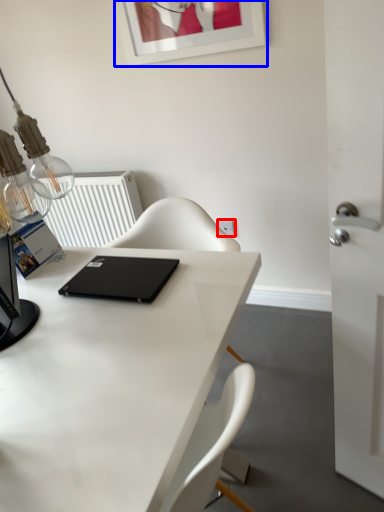
Question: Which object is closer to the camera taking this photo, electric outlet (highlighted by a red box) or picture frame (highlighted by a blue box)?

Choices:
 (A) electric outlet
 (B) picture frame

Answer: (B)